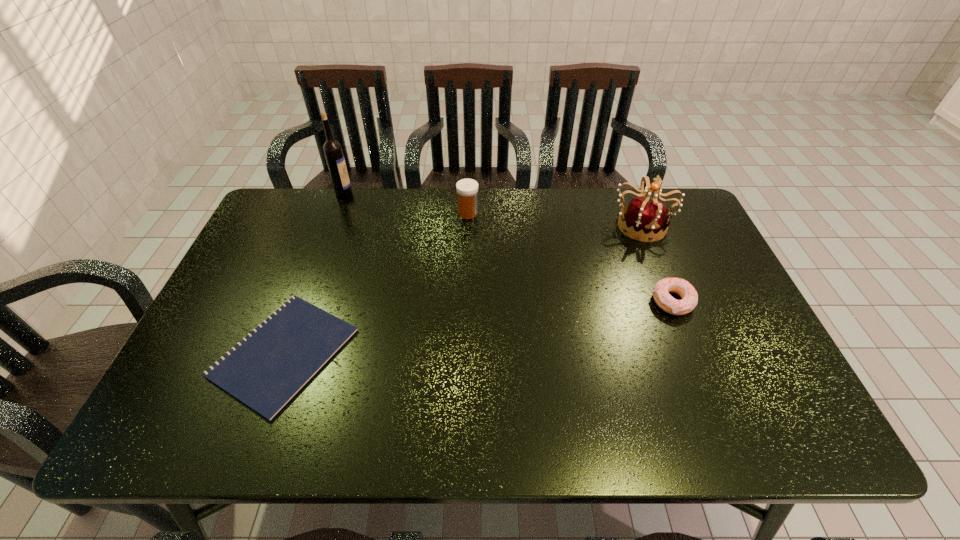
Where is `the farthest object`? the farthest object is located at coordinates (332, 149).

This screenshot has width=960, height=540. What are the coordinates of `wine bottle` in the screenshot? It's located at (332, 149).

This screenshot has width=960, height=540. What are the coordinates of `tiara` in the screenshot? It's located at (642, 216).

Locate an element on the screen. medicine is located at coordinates (467, 189).

Where is `the third tallest object`? This screenshot has width=960, height=540. the third tallest object is located at coordinates (467, 189).

Find the location of a particular element. The width and height of the screenshot is (960, 540). the second shortest object is located at coordinates (683, 288).

This screenshot has width=960, height=540. I want to click on the shortest object, so click(265, 370).

At what (x,y) coordinates should I click in order to perform the action: click on free space located on the label of the wine bottle. Please return your answer as a coordinate pair (x, y). This screenshot has height=540, width=960. Looking at the image, I should click on (454, 193).

Find the location of a particular element. vacant space situated 0.180m on the front-facing side of the fourth shortest object is located at coordinates (666, 287).

Image resolution: width=960 pixels, height=540 pixels. What are the coordinates of `vacant area situated on the right of the medicine` in the screenshot? It's located at (524, 213).